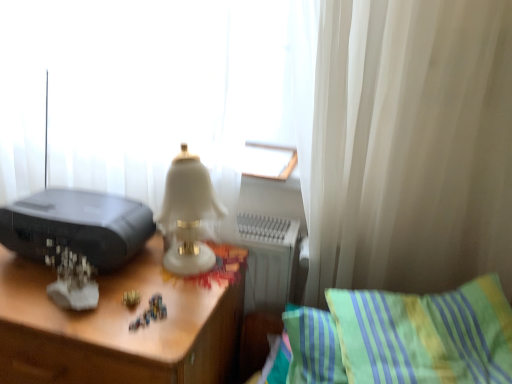
Where is `vacant space situated above wooden desk at center (from a real-world perspective)`? Image resolution: width=512 pixels, height=384 pixels. vacant space situated above wooden desk at center (from a real-world perspective) is located at coordinates (101, 285).